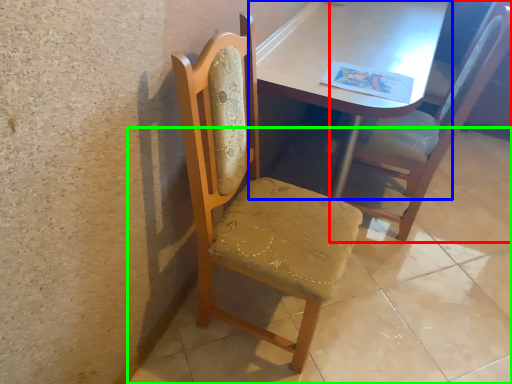
Question: Based on their relative distances, which object is farther from chair (highlighted by a red box)? Choose from table (highlighted by a blue box) and concrete (highlighted by a green box).

Choices:
 (A) table
 (B) concrete

Answer: (B)